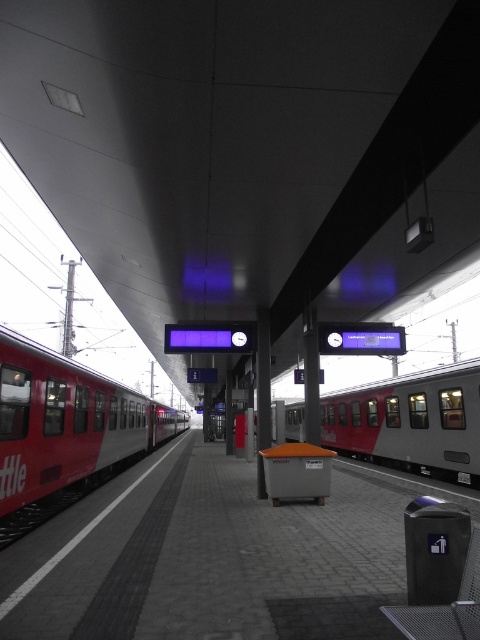
Who is higher up, red matte train at left or silver metallic train at center?

red matte train at left is higher up.

Which is in front, point (41, 346) or point (391, 432)?

Point (41, 346) is in front.

The width and height of the screenshot is (480, 640). Identify the location of red matte train at left. (64, 432).